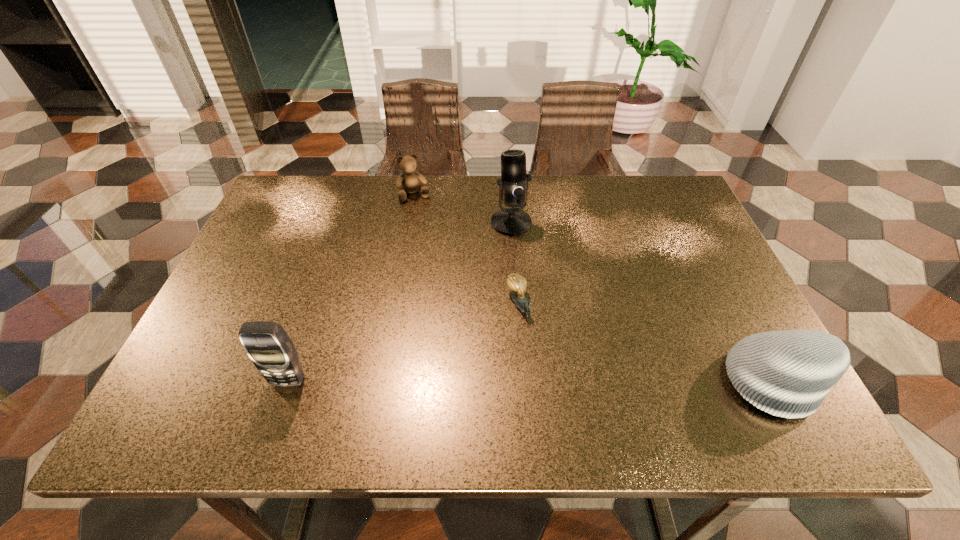
Locate an element on the screen. The width and height of the screenshot is (960, 540). free space that is in between the fourth shortest object and the beanie is located at coordinates (534, 381).

Choose which object is the third nearest neighbor to the tallest object. Please provide its 2D coordinates. Your answer should be formatted as a tuple, i.e. [(x, y)], where the tuple contains the x and y coordinates of a point satisfying the conditions above.

[(788, 373)]

Select which object is the fourth closest to the shortest object. Please provide its 2D coordinates. Your answer should be formatted as a tuple, i.e. [(x, y)], where the tuple contains the x and y coordinates of a point satisfying the conditions above.

[(267, 344)]